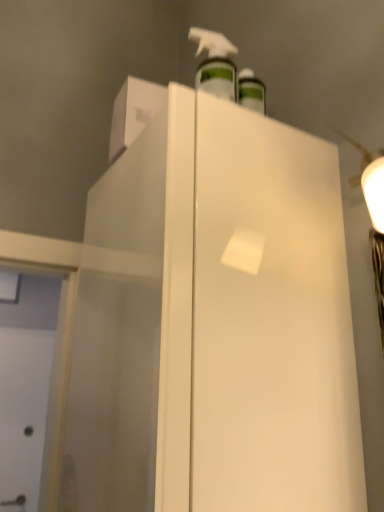
The width and height of the screenshot is (384, 512). Identify the location of white matte screen door at lower left. (27, 390).

The width and height of the screenshot is (384, 512). What do you see at coordinates (27, 390) in the screenshot?
I see `white matte screen door at lower left` at bounding box center [27, 390].

This screenshot has height=512, width=384. In order to click on white matte screen door at lower left in this screenshot , I will do `click(27, 390)`.